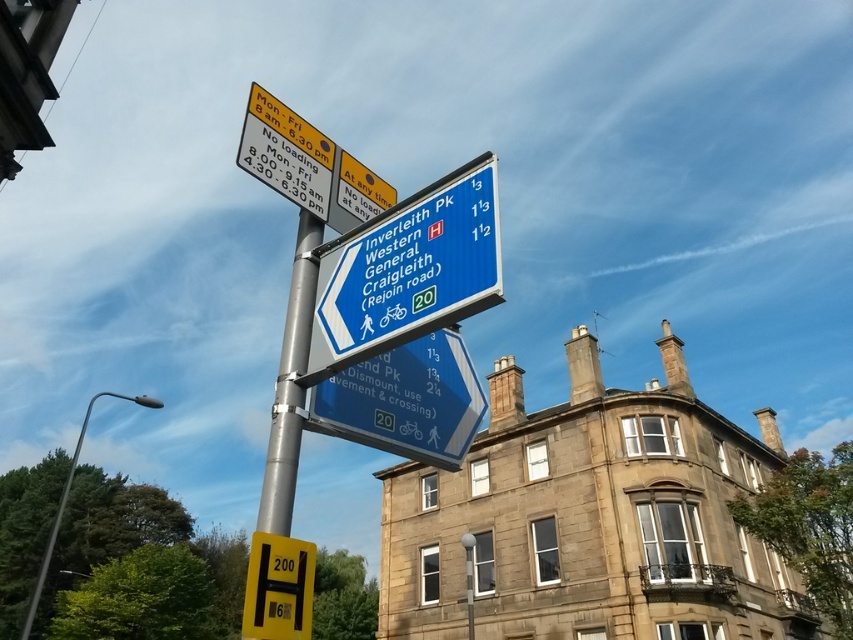
Question: Does blue plastic sign at upper center have a lesser width compared to yellow matte parking sign at lower left?

Choices:
 (A) yes
 (B) no

Answer: (A)

Question: Which of the following is the closest to the observer?

Choices:
 (A) yellow matte parking sign at lower left
 (B) blue plastic road sign at upper center
 (C) blue plastic sign at upper center
 (D) silver metallic pole at center

Answer: (A)

Question: Estimate the real-world distances between objects in this image. Which object is farther from the blue plastic road sign at upper center?

Choices:
 (A) silver metallic pole at center
 (B) yellow matte parking sign at lower left

Answer: (B)

Question: Can you confirm if blue plastic sign at upper center is thinner than yellow matte parking sign at lower left?

Choices:
 (A) no
 (B) yes

Answer: (B)

Question: Is blue plastic sign at upper center wider than yellow matte parking sign at lower left?

Choices:
 (A) yes
 (B) no

Answer: (B)

Question: Considering the real-world distances, which object is closest to the blue plastic road sign at upper center?

Choices:
 (A) silver metallic pole at center
 (B) yellow matte parking sign at lower left

Answer: (A)